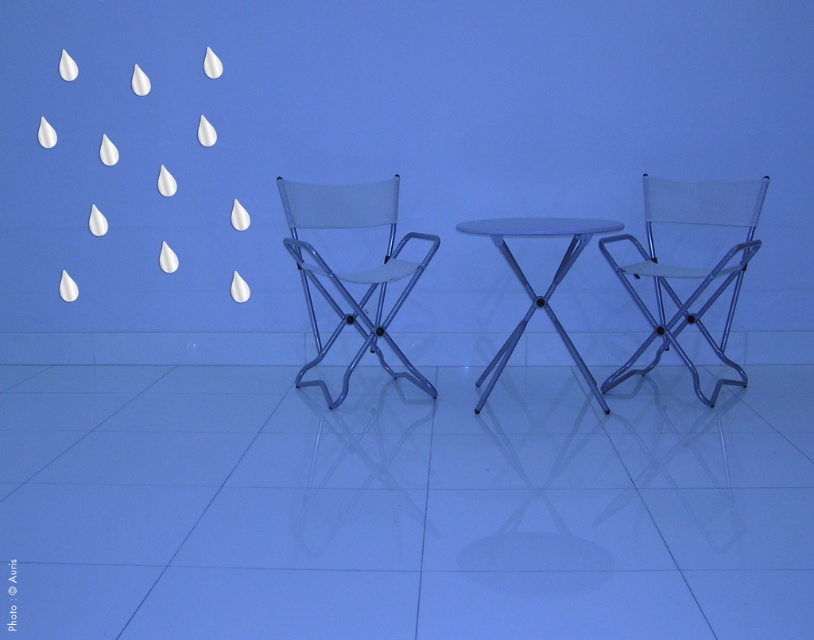
Question: Considering the real-world distances, which object is farthest from the metallic silver table at center?

Choices:
 (A) translucent plastic chair at right
 (B) white fabric chair at center

Answer: (B)

Question: Can you confirm if translucent plastic chair at right is wider than white fabric chair at center?

Choices:
 (A) yes
 (B) no

Answer: (A)

Question: Does translucent plastic chair at right come in front of metallic silver table at center?

Choices:
 (A) yes
 (B) no

Answer: (B)

Question: Can you confirm if white fabric chair at center is positioned above metallic silver table at center?

Choices:
 (A) no
 (B) yes

Answer: (B)

Question: Which object is positioned farthest from the white fabric chair at center?

Choices:
 (A) metallic silver table at center
 (B) translucent plastic chair at right

Answer: (B)

Question: Which of the following is the closest to the observer?

Choices:
 (A) (302, 244)
 (B) (572, 244)
 (C) (664, 268)

Answer: (A)